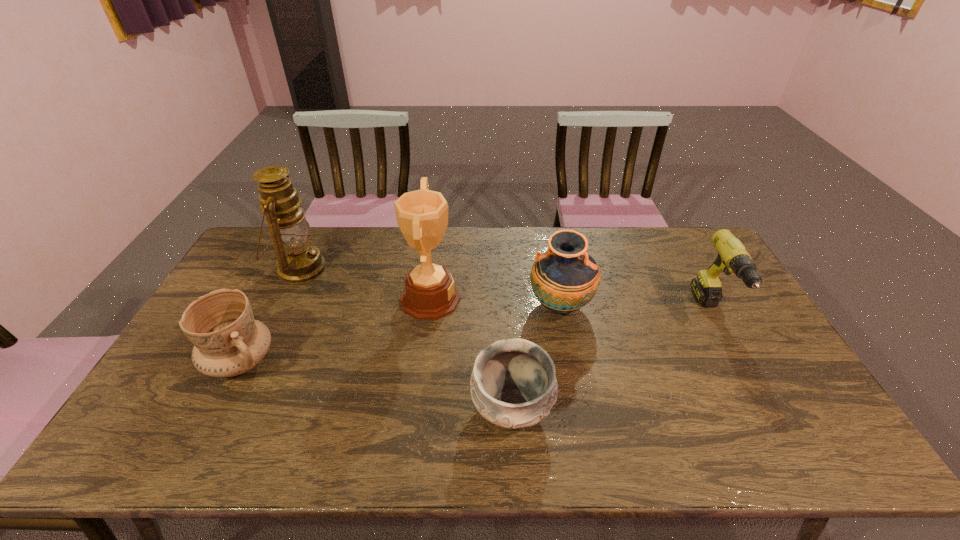
Image resolution: width=960 pixels, height=540 pixels. What are the coordinates of `vacant area situated 0.150m on the handle side of the rightmost object` in the screenshot? It's located at (754, 387).

Where is `free space located 0.050m on the right of the second shortest object`? The height and width of the screenshot is (540, 960). free space located 0.050m on the right of the second shortest object is located at coordinates (294, 361).

The image size is (960, 540). In order to click on free space located 0.090m on the right of the shortest pottery in this screenshot , I will do `click(589, 408)`.

At what (x,y) coordinates should I click in order to perform the action: click on object present at the far edge. Please return your answer as a coordinate pair (x, y). Image resolution: width=960 pixels, height=540 pixels. Looking at the image, I should click on (298, 261).

The image size is (960, 540). In order to click on object that is at the near edge in this screenshot , I will do `click(513, 385)`.

This screenshot has height=540, width=960. I want to click on oil lamp that is at the left edge, so click(x=298, y=261).

I want to click on pottery at the left edge, so [x=228, y=341].

Identify the location of object located in the right edge section of the desktop. (732, 257).

Identify the location of object present at the far left corner. (298, 261).

I want to click on vacant space at the far edge of the desktop, so click(x=462, y=230).